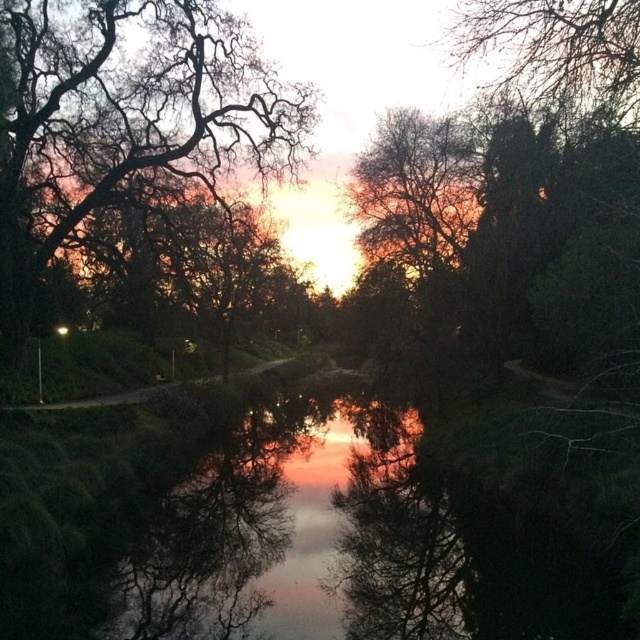
You are an artist trying to paint the sunset scene. You want to ensure the depth of the trees in the painting matches the image. Which of the two objects, the silhouette bare branches at upper left or the bare branches at upper center, appears closer to you?

The silhouette bare branches at upper left appears closer because the bare branches at upper center is behind it.

You are standing in the park and see two points in the sunset scene. The first point is at coordinates point (51,109) and the second is at point (484,29). Which point is closer to you?

Point (51,109) is further to the viewer than point (484,29), so the second point is closer to you.

You are an artist painting the sunset scene. You notice two sets of branches in the upper part of the image. Which set of branches, the silhouette bare branches at upper left or the bare branches at upper center, would cast a bigger shadow on your canvas?

The silhouette bare branches at upper left is larger in size than the bare branches at upper center, so it would cast a bigger shadow on your canvas.